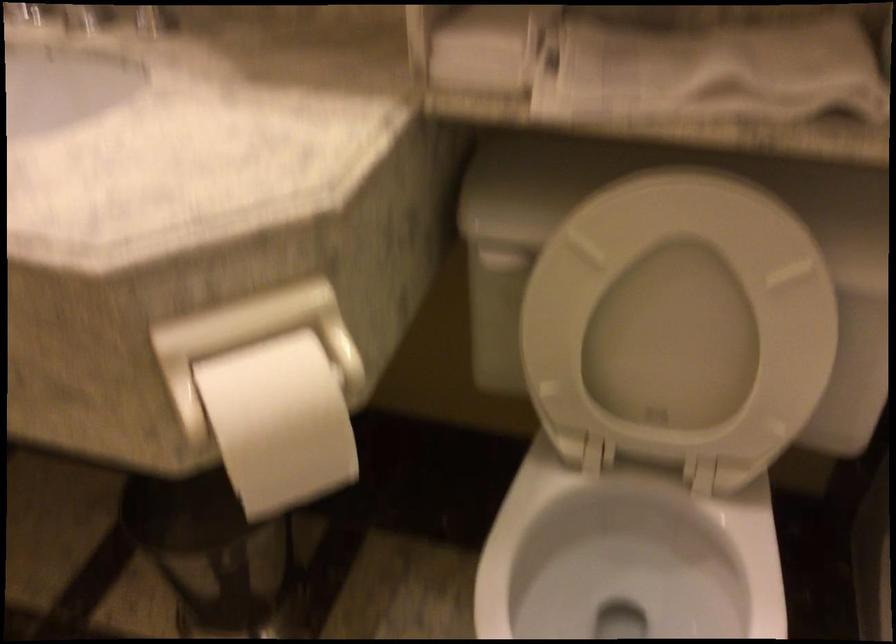
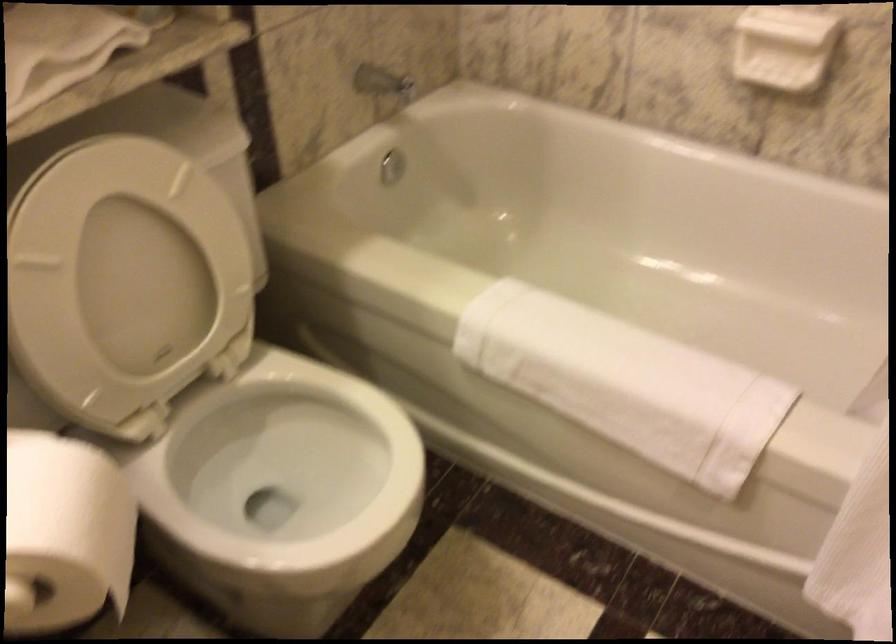
Based on the continuous images, in which direction is the camera rotating?

The camera's rotation is toward right-down.